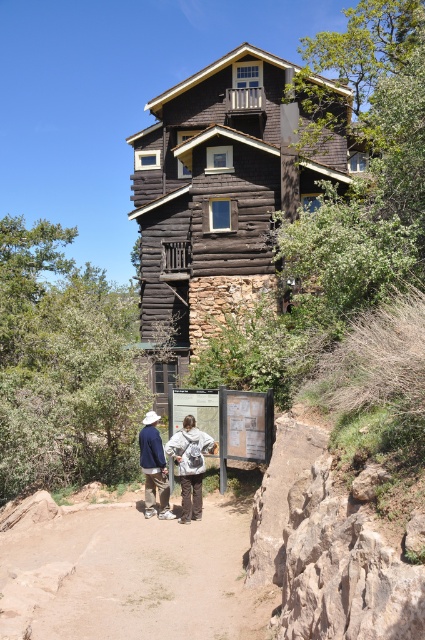
How far apart are dark brown wood log cabin at center and matte brown pants at lower center?

dark brown wood log cabin at center and matte brown pants at lower center are 7.90 meters apart from each other.

Is point (314, 81) closer to viewer compared to point (147, 502)?

That is False.

Find the location of a particular element. dark brown wood log cabin at center is located at coordinates (217, 198).

Where is `dark brown wood log cabin at center`? dark brown wood log cabin at center is located at coordinates [217, 198].

Identify the location of dark brown wood log cabin at center. (217, 198).

How much distance is there between dark brown wood log cabin at center and khaki cotton pants at center?

dark brown wood log cabin at center and khaki cotton pants at center are 18.79 feet apart from each other.

Is point (172, 291) less distant than point (147, 480)?

No.

This screenshot has width=425, height=640. Identify the location of dark brown wood log cabin at center. (217, 198).

Does brown dirt path at lower center have a greater width compared to matte brown pants at lower center?

In fact, brown dirt path at lower center might be narrower than matte brown pants at lower center.

Who is more forward, (198, 584) or (164, 477)?

Point (198, 584) is more forward.

Is point (107, 547) positioned behind point (169, 509)?

No, (107, 547) is closer to viewer.

Image resolution: width=425 pixels, height=640 pixels. Identify the location of brown dirt path at lower center. (127, 573).